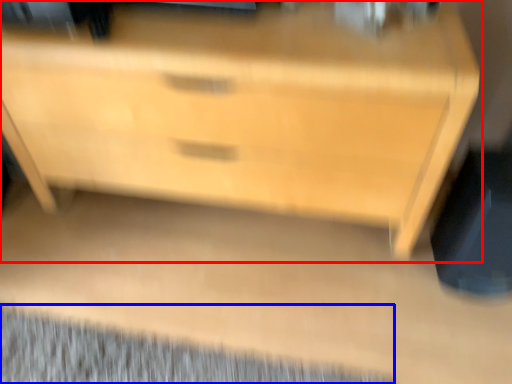
Question: Which object appears closest to the camera in this image, chest of drawers (highlighted by a red box) or mat (highlighted by a blue box)?

Choices:
 (A) chest of drawers
 (B) mat

Answer: (A)